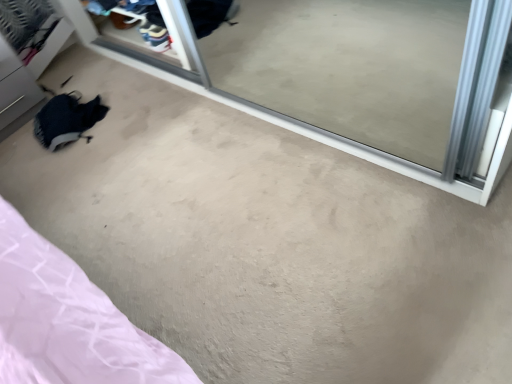
Image resolution: width=512 pixels, height=384 pixels. In order to click on vacant area situated to the left side of white leather sneakers at upper center in this screenshot , I will do `click(128, 49)`.